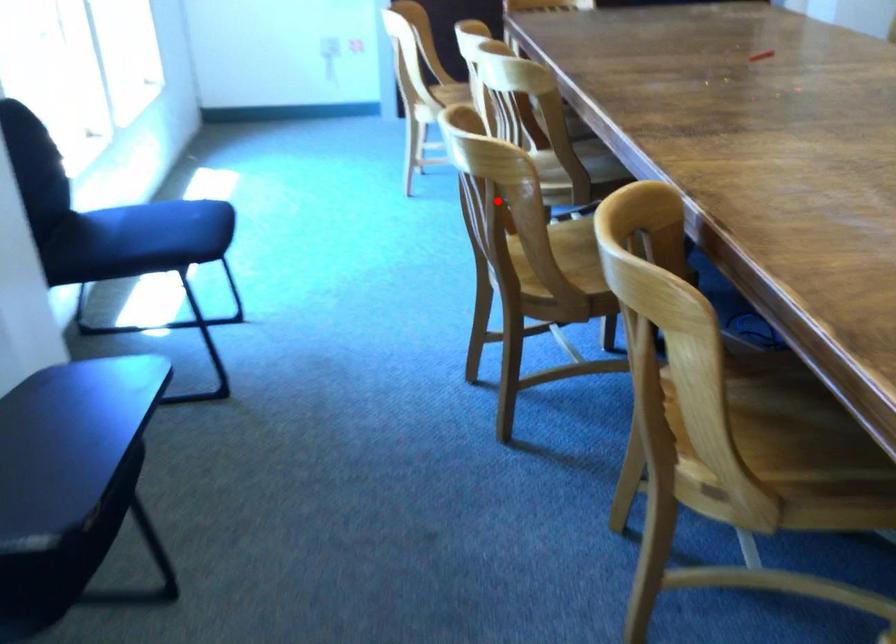
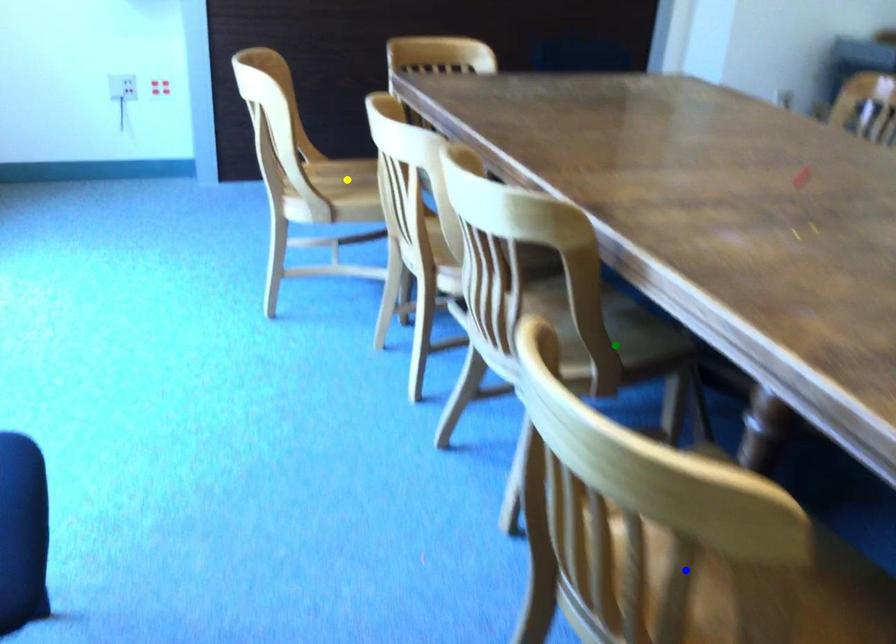
Question: I am providing you with two images of the same scene from different viewpoints. A red point is marked on the first image. You are given multiple points on the second image. Which spot in image 2 lines up with the point in image 1?

Choices:
 (A) yellow point
 (B) green point
 (C) blue point

Answer: (C)